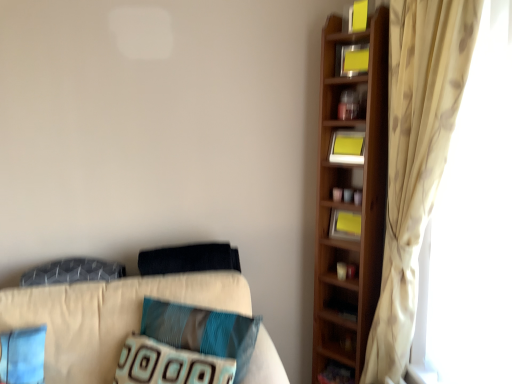
Question: Are teal fabric pillow at center, which is the third pillow in top-to-bottom order, and yellow paper at upper right, the 1th book positioned from the top, beside each other?

Choices:
 (A) yes
 (B) no

Answer: (B)

Question: Does teal fabric pillow at center, which is the third pillow in top-to-bottom order, have a greater width compared to yellow paper at upper right, the 1th book positioned from the top?

Choices:
 (A) yes
 (B) no

Answer: (A)

Question: Is yellow paper at upper right, which appears as the fourth book when ordered from the bottom, surrounded by teal fabric pillow at center, which is the third pillow in top-to-bottom order?

Choices:
 (A) yes
 (B) no

Answer: (B)

Question: Can you confirm if teal fabric pillow at center, which is the third pillow in top-to-bottom order, is taller than yellow paper at upper right, which appears as the fourth book when ordered from the bottom?

Choices:
 (A) yes
 (B) no

Answer: (A)

Question: Does teal fabric pillow at center, the second pillow from the bottom, come in front of yellow paper at upper right, which appears as the fourth book when ordered from the bottom?

Choices:
 (A) no
 (B) yes

Answer: (B)

Question: From a real-world perspective, is teal fabric pillow at center, which is the third pillow in top-to-bottom order, physically below yellow paper at upper right, the 1th book positioned from the top?

Choices:
 (A) no
 (B) yes

Answer: (B)

Question: Can you confirm if textured blue pillow at center, the first pillow from the bottom, is shorter than yellow paper at upper right, the 3th book in the top-to-bottom sequence?

Choices:
 (A) no
 (B) yes

Answer: (A)

Question: Is textured blue pillow at center, acting as the 4th pillow starting from the top, behind yellow paper at upper right, the 3th book in the top-to-bottom sequence?

Choices:
 (A) no
 (B) yes

Answer: (A)

Question: From the image's perspective, is textured blue pillow at center, acting as the 4th pillow starting from the top, below yellow paper at upper right, the second book ordered from the bottom?

Choices:
 (A) no
 (B) yes

Answer: (B)

Question: From the image's perspective, is textured blue pillow at center, acting as the 4th pillow starting from the top, above yellow paper at upper right, the 3th book in the top-to-bottom sequence?

Choices:
 (A) no
 (B) yes

Answer: (A)

Question: Is yellow paper at upper right, the 3th book in the top-to-bottom sequence, located within textured blue pillow at center, acting as the 4th pillow starting from the top?

Choices:
 (A) yes
 (B) no

Answer: (B)

Question: Does textured blue pillow at center, the first pillow from the bottom, have a greater width compared to yellow paper at upper right, the 3th book in the top-to-bottom sequence?

Choices:
 (A) no
 (B) yes

Answer: (B)

Question: Can you confirm if yellow matte bookshelf at upper right, the second book when ordered from top to bottom, is positioned to the right of beige floral curtain at right?

Choices:
 (A) yes
 (B) no

Answer: (B)